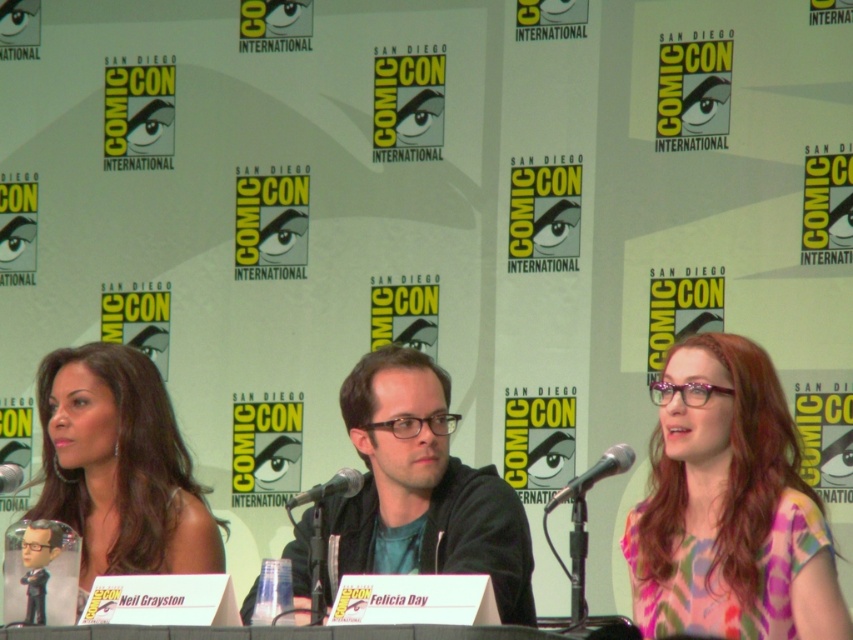
You are attending San Diego Comic Con and want to take a photo of the Comic Con logo. You notice two points marked on the floor at coordinates point (669, 520) and point (412, 380). Which point is closer to the logo backdrop?

Point (669, 520) is in front of point (412, 380), so it is closer to the logo backdrop.

You are a photographer at San Diego ComicCon International. You want to take a photo of the metallic silver microphone at center. What are the coordinates of the microphone?

The coordinates of the metallic silver microphone at center are at point [595,474].

Based on the photo, you are a photographer at San Diego ComicCon International and want to take a photo of the two points mentioned. Which point is closer to you, point (x=74, y=472) or point (x=1, y=470)?

Point (x=1, y=470) is closer to you because it is less far away than point (x=74, y=472).